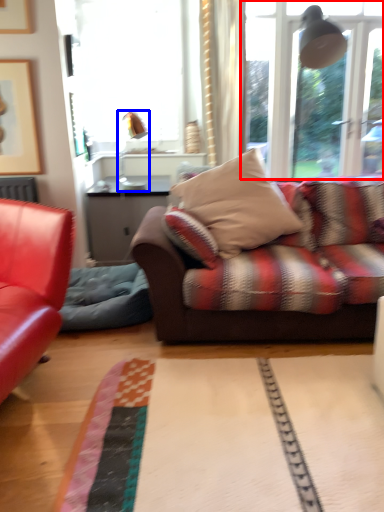
Question: Which point is further to the camera, window (highlighted by a red box) or lamp (highlighted by a blue box)?

Choices:
 (A) window
 (B) lamp

Answer: (B)